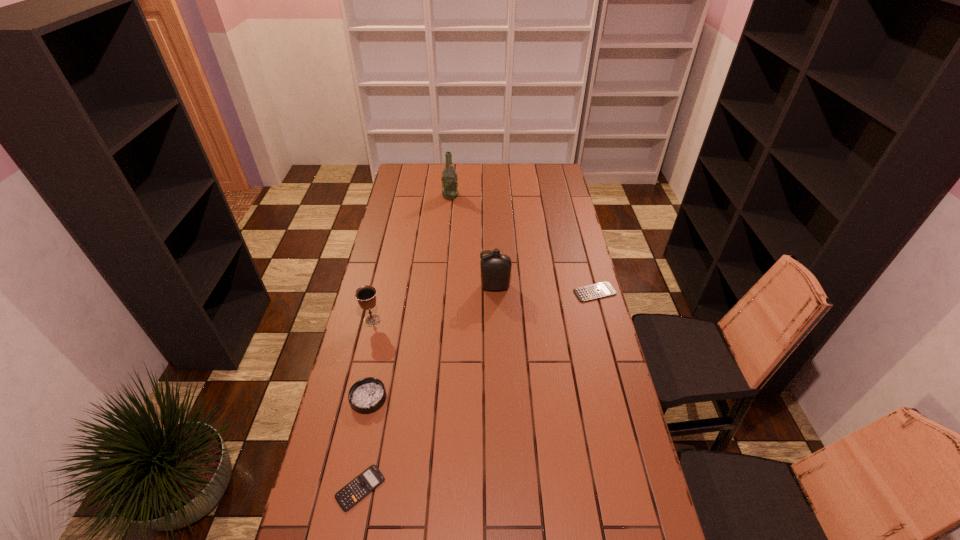
At what (x,y) coordinates should I click in order to perform the action: click on the nearer calculator. Please return your answer as a coordinate pair (x, y). This screenshot has height=540, width=960. Looking at the image, I should click on (347, 497).

Find the location of a particular element. Image resolution: width=960 pixels, height=540 pixels. the left calculator is located at coordinates (347, 497).

The image size is (960, 540). In order to click on the right calculator in this screenshot , I will do `click(599, 290)`.

Identify the location of the fifth tallest object. (599, 290).

You are a GUI agent. You are given a task and a screenshot of the screen. Output one action in this format:
    pyautogui.click(x=<x>, y=<y>)
    Task: Click on the tallest object
    The height and width of the screenshot is (540, 960).
    Given the screenshot: What is the action you would take?
    pyautogui.click(x=449, y=181)

This screenshot has height=540, width=960. I want to click on the third object from right to left, so (449, 181).

Locate an element on the screen. chalice is located at coordinates (366, 295).

At what (x,y) coordinates should I click in order to perform the action: click on the third nearest object. Please return your answer as a coordinate pair (x, y). This screenshot has width=960, height=540. Looking at the image, I should click on (366, 295).

Image resolution: width=960 pixels, height=540 pixels. Find the location of `bottle`. bottle is located at coordinates (495, 268).

Identify the location of the fifth object from left to right. (495, 268).